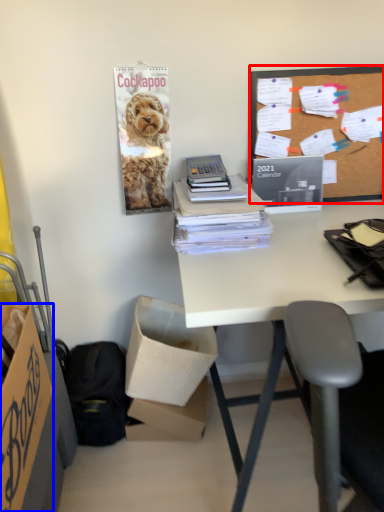
Question: Which point is closer to the camera, whiteboard (highlighted by a red box) or box (highlighted by a blue box)?

Choices:
 (A) whiteboard
 (B) box

Answer: (B)